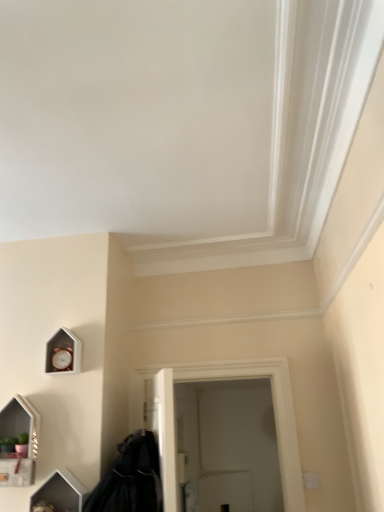
What do you see at coordinates (18, 442) in the screenshot? I see `matte white medicine cabinet at lower left` at bounding box center [18, 442].

Locate an element on the screen. Image resolution: width=384 pixels, height=512 pixels. white glossy vanity at lower left is located at coordinates (49, 493).

Based on the photo, between wooden clock at lower left and white glossy vanity at lower left, which one has smaller width?

With smaller width is wooden clock at lower left.

Find the location of a particular element. vanity located below the wooden clock at lower left (from the image's perspective) is located at coordinates (49, 493).

From a real-world perspective, which object rests below the other?

In real-world perspective, white glossy vanity at lower left is lower.

Is wooden clock at lower left not inside white glossy vanity at lower left?

Yes, wooden clock at lower left is not within white glossy vanity at lower left.

From the image's perspective, does white glossy vanity at lower left appear higher than wooden clock at lower left?

Actually, white glossy vanity at lower left appears below wooden clock at lower left in the image.

Is white glossy vanity at lower left inside or outside of wooden clock at lower left?

white glossy vanity at lower left exists outside the volume of wooden clock at lower left.

Consider the image. Considering the sizes of objects white glossy vanity at lower left and wooden clock at lower left in the image provided, who is bigger, white glossy vanity at lower left or wooden clock at lower left?

→ white glossy vanity at lower left is bigger.

Considering their positions, is white glossy vanity at lower left located in front of or behind wooden clock at lower left?

Answer: white glossy vanity at lower left is in front of wooden clock at lower left.

From the image's perspective, who appears lower, matte white medicine cabinet at lower left or white glossy vanity at lower left?

white glossy vanity at lower left appears lower in the image.

Identify the location of vanity that appears on the right of matte white medicine cabinet at lower left. The height and width of the screenshot is (512, 384). (49, 493).

Considering the sizes of objects matte white medicine cabinet at lower left and white glossy vanity at lower left in the image provided, who is taller, matte white medicine cabinet at lower left or white glossy vanity at lower left?

With more height is matte white medicine cabinet at lower left.

From the image's perspective, relative to matte white medicine cabinet at lower left, is black matte coat at lower left above or below?

Clearly, from the image's perspective, black matte coat at lower left is below matte white medicine cabinet at lower left.

Image resolution: width=384 pixels, height=512 pixels. In order to click on medicine cabinet above the black matte coat at lower left (from the image's perspective) in this screenshot , I will do `click(18, 442)`.

Is black matte coat at lower left taller than matte white medicine cabinet at lower left?

No, black matte coat at lower left is not taller than matte white medicine cabinet at lower left.

Is black matte coat at lower left bigger or smaller than matte white medicine cabinet at lower left?

Considering their sizes, black matte coat at lower left takes up more space than matte white medicine cabinet at lower left.

Between matte white medicine cabinet at lower left and wooden clock at lower left, which one has larger width?

matte white medicine cabinet at lower left.

Identify the location of medicine cabinet that appears on the left of wooden clock at lower left. (18, 442).

Is wooden clock at lower left completely or partially inside matte white medicine cabinet at lower left?

That's incorrect, wooden clock at lower left is not inside matte white medicine cabinet at lower left.

Consider the image. Which is closer to the camera, (64, 503) or (287, 392)?

Point (64, 503) appears to be closer to the viewer than point (287, 392).

From a real-world perspective, is white glossy vanity at lower left beneath white matte door at center?

Yes.

Considering the sizes of objects white glossy vanity at lower left and white matte door at center in the image provided, who is smaller, white glossy vanity at lower left or white matte door at center?

white glossy vanity at lower left is smaller.

From the image's perspective, which one is positioned higher, white glossy vanity at lower left or white matte door at center?

From the image's view, white matte door at center is above.

Identify the location of vanity that appears in front of the white matte door at center. This screenshot has height=512, width=384. (49, 493).

Between white matte door at center and white glossy vanity at lower left, which one is positioned behind?

white matte door at center is behind.

From the image's perspective, which one is positioned higher, white matte door at center or white glossy vanity at lower left?

white matte door at center is shown above in the image.

Would you say white matte door at center is inside or outside white glossy vanity at lower left?

white matte door at center is not inside white glossy vanity at lower left, it's outside.

I want to click on vanity that is below the wooden clock at lower left (from the image's perspective), so tap(49, 493).

The image size is (384, 512). I want to click on clock that appears behind the white glossy vanity at lower left, so click(63, 353).

Based on their spatial positions, is white matte door at center or matte white medicine cabinet at lower left closer to black matte coat at lower left?

Among the two, matte white medicine cabinet at lower left is located nearer to black matte coat at lower left.

When comparing their distances from white matte door at center, does black matte coat at lower left or wooden clock at lower left seem closer?

black matte coat at lower left is positioned closer to the anchor white matte door at center.

Which object lies nearer to the anchor point matte white medicine cabinet at lower left, black matte coat at lower left or wooden clock at lower left?

wooden clock at lower left is closer to matte white medicine cabinet at lower left.

Considering their positions, is white matte door at center positioned further to matte white medicine cabinet at lower left than black matte coat at lower left?

white matte door at center is further to matte white medicine cabinet at lower left.

Looking at the image, which one is located closer to wooden clock at lower left, black matte coat at lower left or white glossy vanity at lower left?

Among the two, white glossy vanity at lower left is located nearer to wooden clock at lower left.

Looking at the image, which one is located closer to white glossy vanity at lower left, matte white medicine cabinet at lower left or black matte coat at lower left?

matte white medicine cabinet at lower left is closer to white glossy vanity at lower left.

Which object lies nearer to the anchor point wooden clock at lower left, white matte door at center or matte white medicine cabinet at lower left?

matte white medicine cabinet at lower left.

Looking at the image, which one is located closer to matte white medicine cabinet at lower left, white matte door at center or wooden clock at lower left?

wooden clock at lower left.

You are a GUI agent. You are given a task and a screenshot of the screen. Output one action in this format:
    pyautogui.click(x=<x>, y=<y>)
    Task: Click on the cloak between wooden clock at lower left and white matte door at center
    
    Given the screenshot: What is the action you would take?
    coord(130,478)

Identify the location of vanity situated between matte white medicine cabinet at lower left and white matte door at center from left to right. (49, 493).

I want to click on medicine cabinet between wooden clock at lower left and white glossy vanity at lower left vertically, so click(x=18, y=442).

Where is `clock located between matte white medicine cabinet at lower left and white matte door at center in the left-right direction`? The image size is (384, 512). clock located between matte white medicine cabinet at lower left and white matte door at center in the left-right direction is located at coordinates (63, 353).